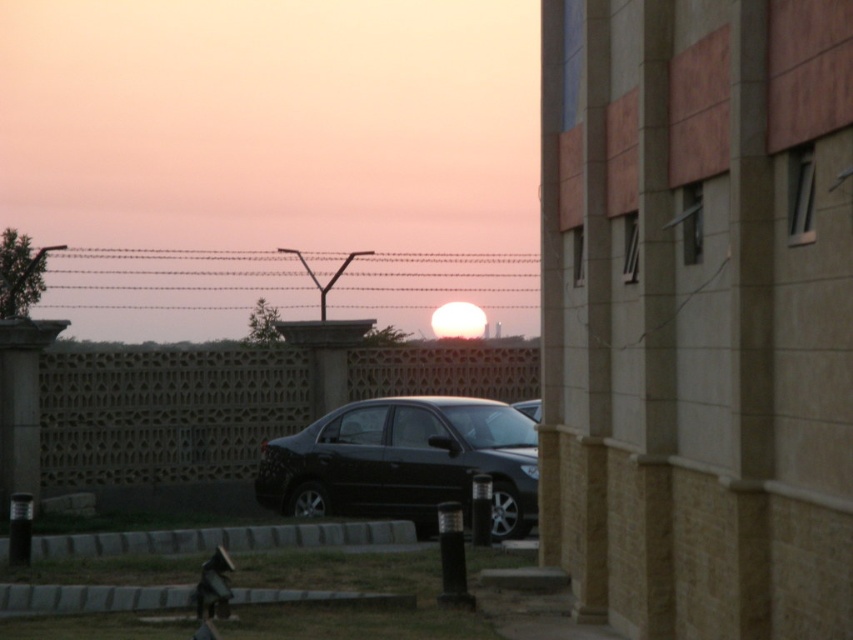
You are a delivery person who needs to park your 15 feet long truck between the light brown textured wall at center and the glossy black car at center. Is there enough space for your truck?

The distance between the light brown textured wall at center and the glossy black car at center is 20.04 feet. Since your truck is 15 feet long, there is sufficient space to park it between them.

You are driving a car and want to park in the parking lot shown in the image. The glossy black car at center is blocking your path to the parking spot. Can you drive around the light brown textured wall at center to reach the parking spot?

The glossy black car at center is behind the light brown textured wall at center, so you cannot drive around the wall to reach the parking spot because the car is already positioned behind it, possibly blocking access.